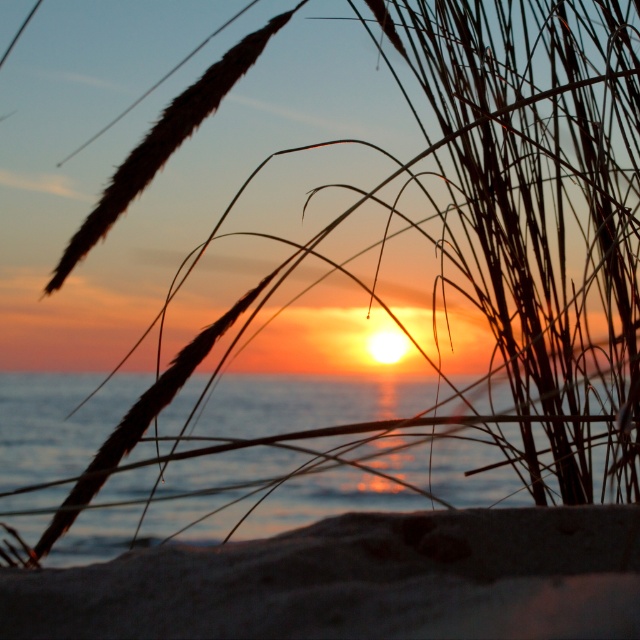
You are standing on the beach and want to walk from the dark brown sandy beach at lower center to the translucent water at center. Which direction should you move to reach the water?

You should move upward because the dark brown sandy beach at lower center is not as tall as the translucent water at center, meaning the water is higher in elevation.

You are standing on the beach and want to walk from the dark brown sandy beach at lower center to the translucent water at center. Which direction should you move?

You should move to the left because the dark brown sandy beach at lower center is to the right of the translucent water at center, so moving left will take you towards the water.

You are standing at the edge of the dark brown sandy beach at lower center. Which direction should you walk to reach the silhouetted grasses in the foreground?

The dark brown sandy beach at lower center is located at point (x=356, y=580). Since the silhouetted grasses are in the foreground, you should walk towards the lower direction to reach them.